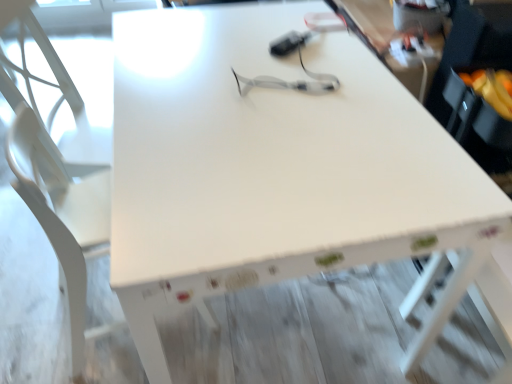
This screenshot has width=512, height=384. What do you see at coordinates (288, 43) in the screenshot?
I see `black plastic charger at upper center` at bounding box center [288, 43].

Locate an element on the screen. black plastic charger at upper center is located at coordinates pyautogui.click(x=288, y=43).

Identify the location of black plastic charger at upper center. Image resolution: width=512 pixels, height=384 pixels. (288, 43).